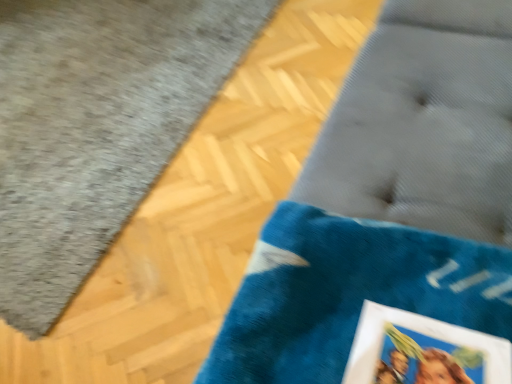
Question: Is velvet blue cushion at lower right wider or thinner than blue velvety bath mat at lower right?

Choices:
 (A) thin
 (B) wide

Answer: (A)

Question: Considering the positions of point (425, 81) and point (50, 276), is point (425, 81) closer or farther from the camera than point (50, 276)?

Choices:
 (A) farther
 (B) closer

Answer: (B)

Question: Relative to blue velvety bath mat at lower right, is velvet blue cushion at lower right in front or behind?

Choices:
 (A) front
 (B) behind

Answer: (A)

Question: From a real-world perspective, relative to velvet blue cushion at lower right, is blue velvety bath mat at lower right vertically above or below?

Choices:
 (A) above
 (B) below

Answer: (B)

Question: Would you say blue velvety bath mat at lower right is to the left or to the right of velvet blue cushion at lower right in the picture?

Choices:
 (A) left
 (B) right

Answer: (A)

Question: Looking at the image, does blue velvety bath mat at lower right seem bigger or smaller compared to velvet blue cushion at lower right?

Choices:
 (A) small
 (B) big

Answer: (A)

Question: In terms of width, does blue velvety bath mat at lower right look wider or thinner when compared to velvet blue cushion at lower right?

Choices:
 (A) wide
 (B) thin

Answer: (A)